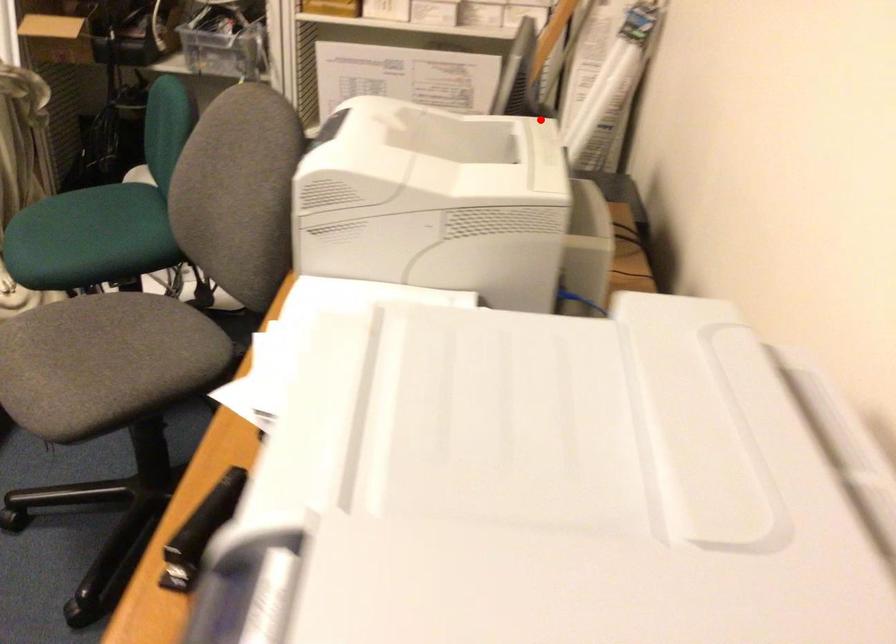
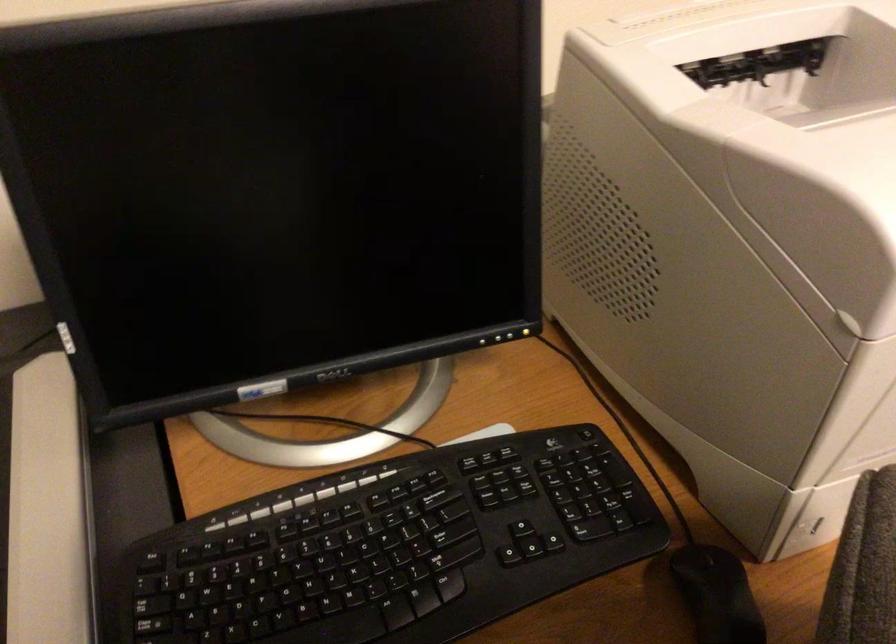
Question: I am providing you with two images of the same scene from different viewpoints. A red point is shown in image1. For the corresponding object point in image2, is it positioned nearer or farther from the camera?

Choices:
 (A) Nearer
 (B) Farther

Answer: (A)